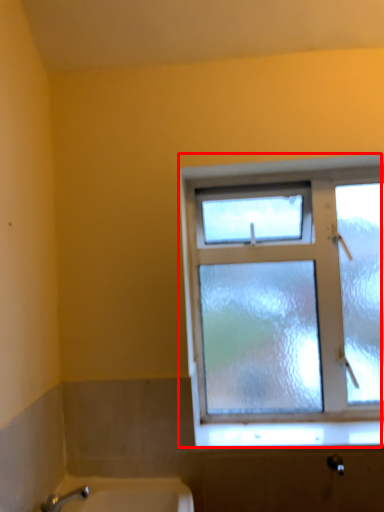
Question: From the image, what is the correct spatial relationship of window (annotated by the red box) in relation to window sill?

Choices:
 (A) right
 (B) left

Answer: (A)